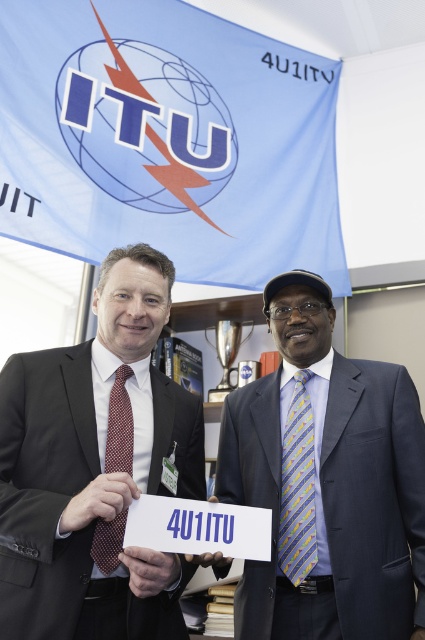
Can you confirm if matte black suit at center is taller than yellow striped tie at center?

Yes.

Looking at this image, can you confirm if matte black suit at center is positioned to the left of yellow striped tie at center?

Yes, matte black suit at center is to the left of yellow striped tie at center.

Does point (101, 362) come in front of point (280, 560)?

Yes, it is.

In order to click on matte black suit at center in this screenshot , I will do `click(93, 468)`.

Which is more to the right, yellow striped tie at center or polka dot silk tie at center?

yellow striped tie at center is more to the right.

Does yellow striped tie at center lie in front of polka dot silk tie at center?

No, yellow striped tie at center is behind polka dot silk tie at center.

The width and height of the screenshot is (425, 640). Describe the element at coordinates (297, 486) in the screenshot. I see `yellow striped tie at center` at that location.

Identify the location of yellow striped tie at center. Image resolution: width=425 pixels, height=640 pixels. [297, 486].

Does blue silk suit at center appear over yellow striped tie at center?

Yes.

Is point (399, 588) positioned before point (306, 369)?

Yes, point (399, 588) is closer to viewer.

Image resolution: width=425 pixels, height=640 pixels. Find the location of `blue silk suit at center`. blue silk suit at center is located at coordinates tap(326, 483).